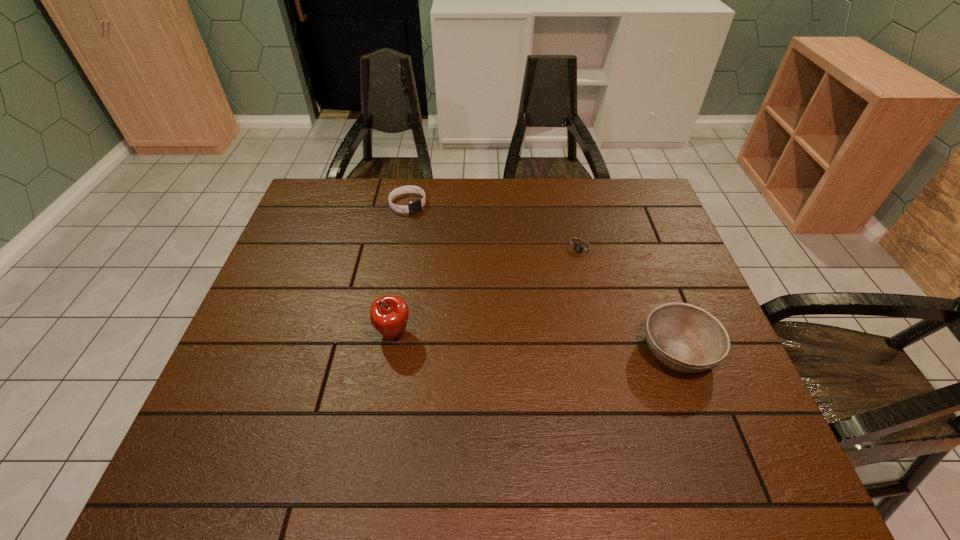
Where is `vacant area situated on the face of the second object from right to left`? vacant area situated on the face of the second object from right to left is located at coordinates (553, 283).

You are a GUI agent. You are given a task and a screenshot of the screen. Output one action in this format:
    pyautogui.click(x=<x>, y=<y>)
    Task: Click on the free space located 0.370m on the face of the second object from right to left
    The image size is (960, 540).
    Given the screenshot: What is the action you would take?
    pyautogui.click(x=500, y=348)

The image size is (960, 540). I want to click on free space located 0.370m on the outer surface of the third tallest object, so coord(488,281).

At what (x,y) coordinates should I click in order to perform the action: click on vacant area situated 0.080m on the outer surface of the third tallest object. Please return your answer as a coordinate pair (x, y). Looking at the image, I should click on (431, 226).

This screenshot has width=960, height=540. I want to click on vacant space situated on the outer surface of the third tallest object, so click(x=494, y=288).

Where is `object positioned at the far edge`? object positioned at the far edge is located at coordinates coord(415,206).

Image resolution: width=960 pixels, height=540 pixels. Identify the location of object present at the right edge. (686, 338).

This screenshot has width=960, height=540. Find the location of `vacant area at the far edge of the desktop`. vacant area at the far edge of the desktop is located at coordinates (379, 178).

Identify the location of vacant region at the near edge. This screenshot has height=540, width=960. (535, 410).

Where is `vacant area at the left edge`? vacant area at the left edge is located at coordinates (224, 376).